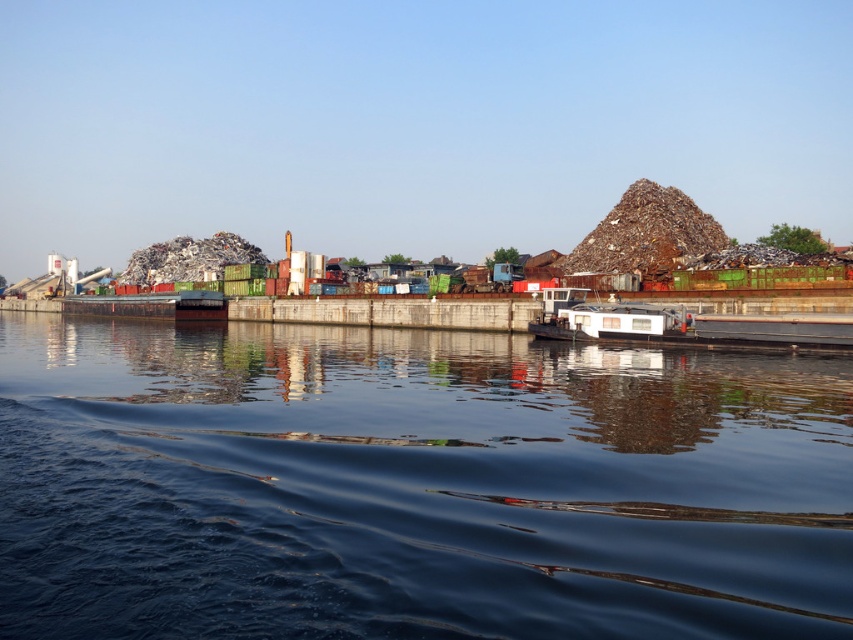
Question: Which of the following is the farthest from the observer?

Choices:
 (A) (392, 632)
 (B) (598, 305)

Answer: (B)

Question: Does dark blue water at center come in front of white matte houseboat at center?

Choices:
 (A) no
 (B) yes

Answer: (B)

Question: Considering the relative positions of dark blue water at center and white matte houseboat at center in the image provided, where is dark blue water at center located with respect to white matte houseboat at center?

Choices:
 (A) below
 (B) above

Answer: (A)

Question: Which point is farther from the camera taking this photo?

Choices:
 (A) (212, 528)
 (B) (558, 314)

Answer: (B)

Question: Is dark blue water at center below white matte houseboat at center?

Choices:
 (A) yes
 (B) no

Answer: (A)